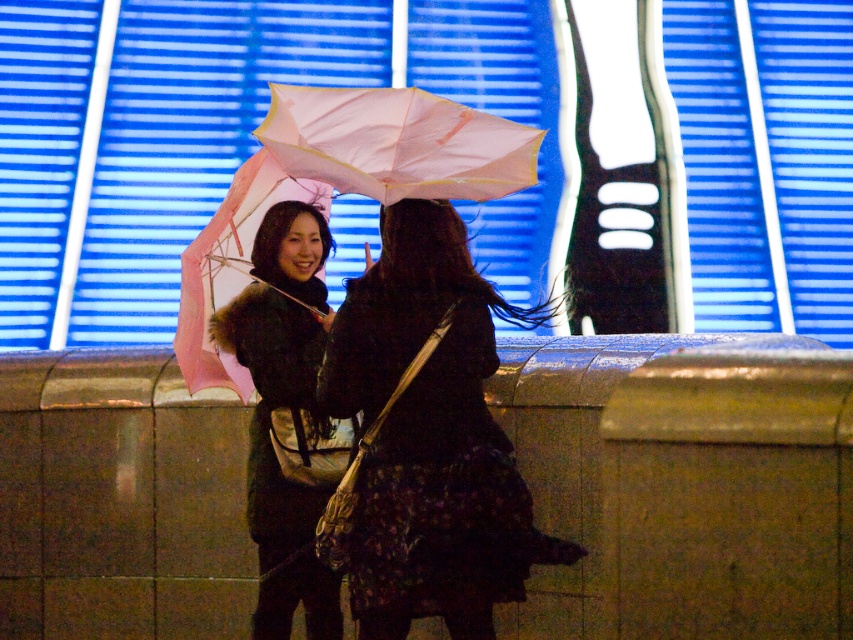
Is concrete ledge at center in front of matte black coat at center?

Yes, it is.

Where is `concrete ledge at center`? concrete ledge at center is located at coordinates (683, 483).

Locate an element on the screen. The width and height of the screenshot is (853, 640). concrete ledge at center is located at coordinates (683, 483).

Can you confirm if concrete ledge at center is thinner than pink matte umbrella at left?

In fact, concrete ledge at center might be wider than pink matte umbrella at left.

Where is `concrete ledge at center`? The image size is (853, 640). concrete ledge at center is located at coordinates (683, 483).

Locate an element on the screen. The width and height of the screenshot is (853, 640). concrete ledge at center is located at coordinates (683, 483).

Is pink matte umbrella at center positioned before pink matte umbrella at left?

Yes, pink matte umbrella at center is in front of pink matte umbrella at left.

Which is behind, point (318, 88) or point (209, 308)?

The point (209, 308) is behind.

Locate an element on the screen. Image resolution: width=853 pixels, height=640 pixels. pink matte umbrella at center is located at coordinates pyautogui.click(x=396, y=144).